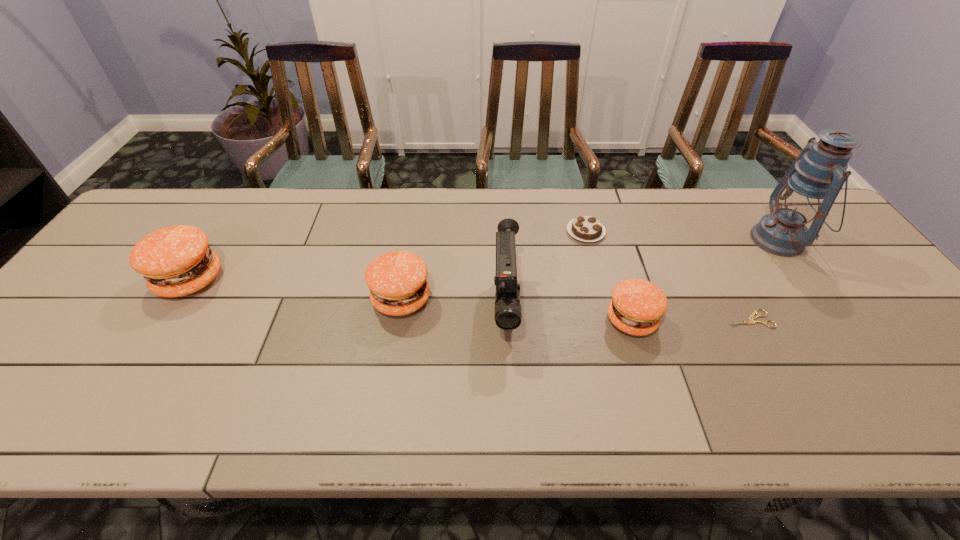
The image size is (960, 540). I want to click on free space between the sixth shortest object and the chocolate cake, so click(545, 269).

Identify the location of free space between the leftmost object and the second object from left to right. (296, 289).

Where is `free space between the sixth object from left to right and the rightmost object`? The width and height of the screenshot is (960, 540). free space between the sixth object from left to right and the rightmost object is located at coordinates (764, 280).

Find the location of a particular element. vacant area that lies between the lantern and the shortest patty is located at coordinates 706,280.

Where is `empty space that is in between the rightmost object and the third shortest object`? empty space that is in between the rightmost object and the third shortest object is located at coordinates (706, 280).

I want to click on vacant space that is in between the leftmost patty and the camcorder, so click(348, 293).

In order to click on free space that is in between the camcorder and the leftmost patty in this screenshot , I will do (x=348, y=293).

Locate an element on the screen. free space between the lantern and the leftmost object is located at coordinates (485, 260).

Identify which object is the sixth nearest to the fifth object from right to left. Please provide its 2D coordinates. Your answer should be formatted as a tuple, i.e. [(x, y)], where the tuple contains the x and y coordinates of a point satisfying the conditions above.

[(176, 261)]

Find the location of a particular element. object that is the fourth closest one to the chocolate cake is located at coordinates (397, 280).